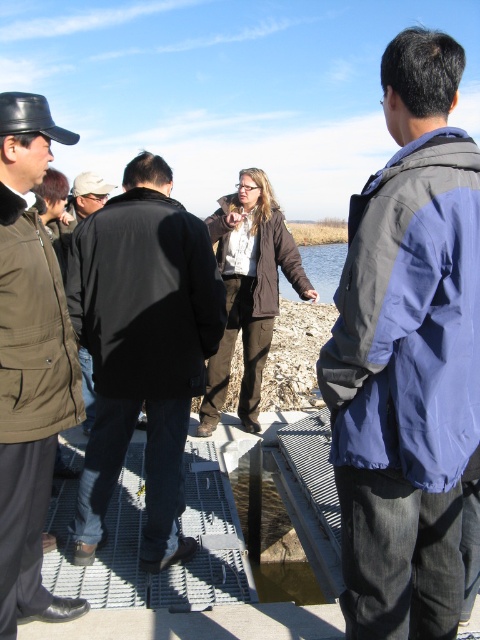
Is blue fabric jacket at upper right behind clear water at center?

No, blue fabric jacket at upper right is in front of clear water at center.

Which of these two, blue fabric jacket at upper right or clear water at center, stands shorter?

With less height is blue fabric jacket at upper right.

Find the location of a particular element. blue fabric jacket at upper right is located at coordinates (408, 356).

Is black matte jacket at center positioned in front of clear water at center?

Yes, it is.

In the scene shown: Between black matte jacket at center and clear water at center, which one has more height?

Standing taller between the two is clear water at center.

What do you see at coordinates (142, 348) in the screenshot? This screenshot has width=480, height=640. I see `black matte jacket at center` at bounding box center [142, 348].

The height and width of the screenshot is (640, 480). In order to click on black matte jacket at center in this screenshot , I will do pyautogui.click(x=142, y=348).

Who is taller, matte black hat at left or clear water at center?

Standing taller between the two is clear water at center.

Is matte black hat at left wider than clear water at center?

No, matte black hat at left is not wider than clear water at center.

Is point (20, 600) closer to viewer compared to point (322, 278)?

Yes.

Image resolution: width=480 pixels, height=640 pixels. In order to click on matte black hat at left in this screenshot , I will do `click(29, 364)`.